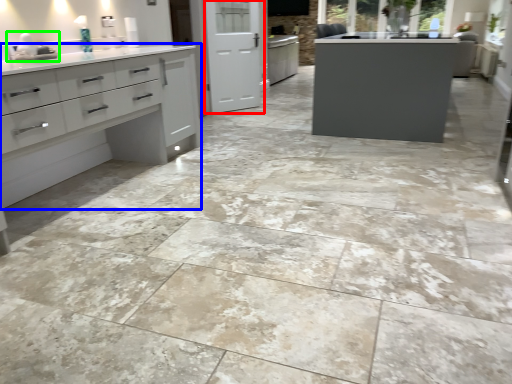
Question: Which is farther away from screen door (highlighted by a red box)? cupboard (highlighted by a blue box) or sink (highlighted by a green box)?

Choices:
 (A) cupboard
 (B) sink

Answer: (B)